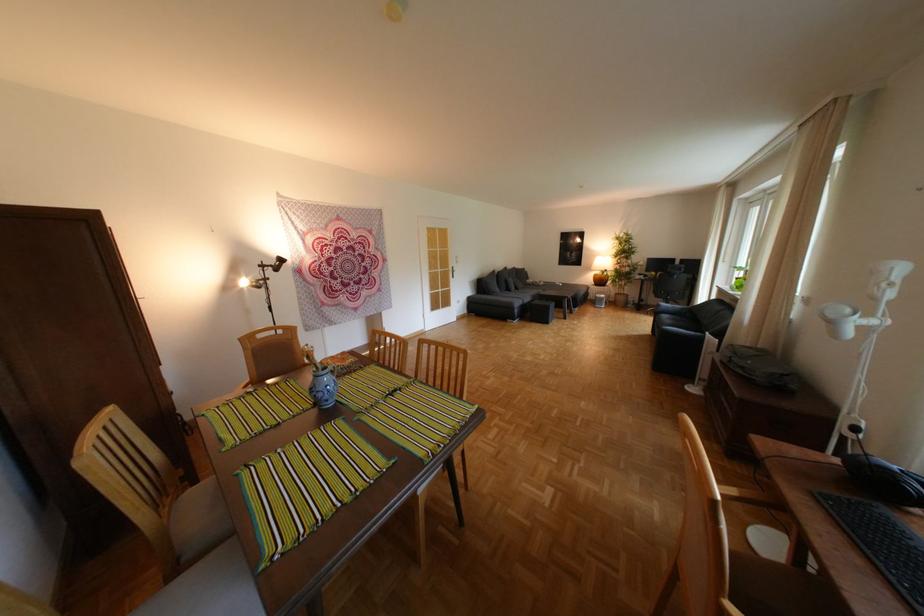
This screenshot has height=616, width=924. I want to click on computer keyboard, so click(881, 543).